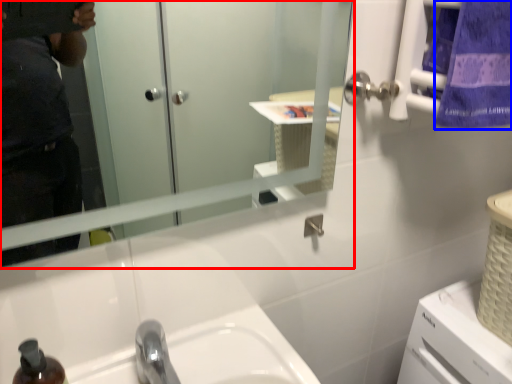
Question: Which of the following is the farthest to the observer, mirror (highlighted by a red box) or towel/napkin (highlighted by a blue box)?

Choices:
 (A) mirror
 (B) towel/napkin

Answer: (B)